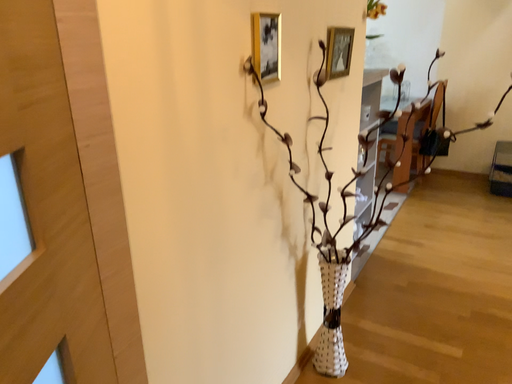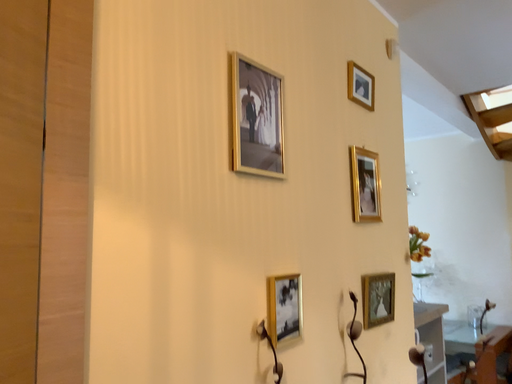
Question: How did the camera likely rotate when shooting the video?

Choices:
 (A) rotated left
 (B) rotated right

Answer: (A)